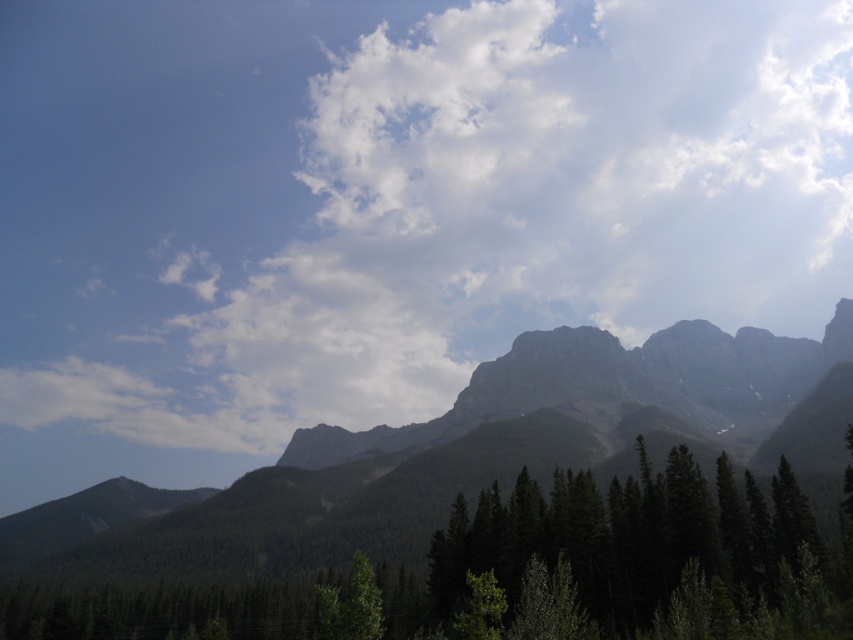
Does green matte tree at lower center appear over green matte tree at center?

Indeed, green matte tree at lower center is positioned over green matte tree at center.

Can you confirm if green matte tree at lower center is smaller than green matte tree at center?

No.

Locate an element on the screen. The width and height of the screenshot is (853, 640). green matte tree at lower center is located at coordinates (648, 556).

The width and height of the screenshot is (853, 640). What do you see at coordinates (456, 452) in the screenshot?
I see `rocky gray mountain range at center` at bounding box center [456, 452].

Can you confirm if rocky gray mountain range at center is positioned below green matte tree at lower center?

Yes, rocky gray mountain range at center is below green matte tree at lower center.

Does point (262, 560) come closer to viewer compared to point (807, 588)?

No, (262, 560) is behind (807, 588).

I want to click on rocky gray mountain range at center, so click(456, 452).

Can you confirm if white fluffy cloud at upper center is smaller than rocky gray mountain range at center?

Actually, white fluffy cloud at upper center might be larger than rocky gray mountain range at center.

Does point (531, 193) come closer to viewer compared to point (495, 397)?

No, (531, 193) is behind (495, 397).

Who is more distant from viewer, (108, 144) or (816, 365)?

Point (108, 144)

Identify the location of white fluffy cloud at upper center. (395, 198).